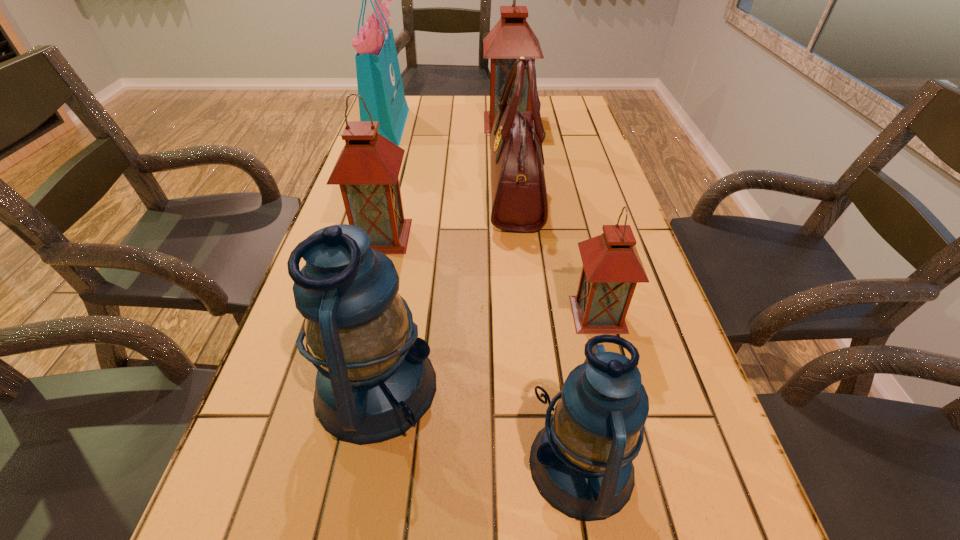
The image size is (960, 540). Identify the location of vacant region that satisfies the following two spatial constraints: 1. on the back side of the nearest pink lantern; 2. on the front-facing side of the brown handbag. click(x=566, y=192).